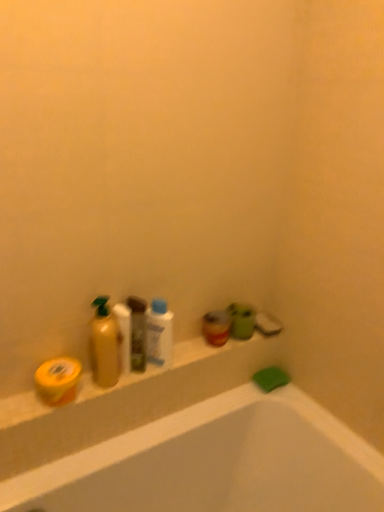
Question: Visually, is yellow matte bar of soap at left, arranged as the first soap when viewed from the left, positioned to the left or to the right of white glossy mouthwash at center, arranged as the 2th mouthwash when viewed from the right?

Choices:
 (A) right
 (B) left

Answer: (B)

Question: Looking at the image, does yellow matte bar of soap at left, positioned as the first soap in top-to-bottom order, seem bigger or smaller compared to white glossy mouthwash at center, which is the 2th mouthwash from back to front?

Choices:
 (A) small
 (B) big

Answer: (A)

Question: Based on their relative distances, which object is farther from the translucent plastic mouthwash at center, marked as the first mouthwash in a right-to-left arrangement?

Choices:
 (A) yellow matte bar of soap at left, the 2th soap from the back
 (B) white glossy mouthwash at center, arranged as the 2th mouthwash when viewed from the right
 (C) shiny gold bottle at left
 (D) matte green cup at upper right, which is the second toiletry in left-to-right order
 (E) green plastic bottle at center, which appears as the 1th toiletry when viewed from the left

Answer: (A)

Question: Estimate the real-world distances between objects in this image. Which object is closer to the yellow matte container at lower left?

Choices:
 (A) white glossy mouthwash at center, the 1th mouthwash viewed from the left
 (B) green matte soap at lower right, the second soap positioned from the top
 (C) translucent plastic mouthwash at center, placed as the second mouthwash when sorted from front to back
 (D) matte green cup at upper right, which is counted as the first toiletry, starting from the back
 (E) green plastic bottle at center, marked as the 2th toiletry in a back-to-front arrangement

Answer: (A)